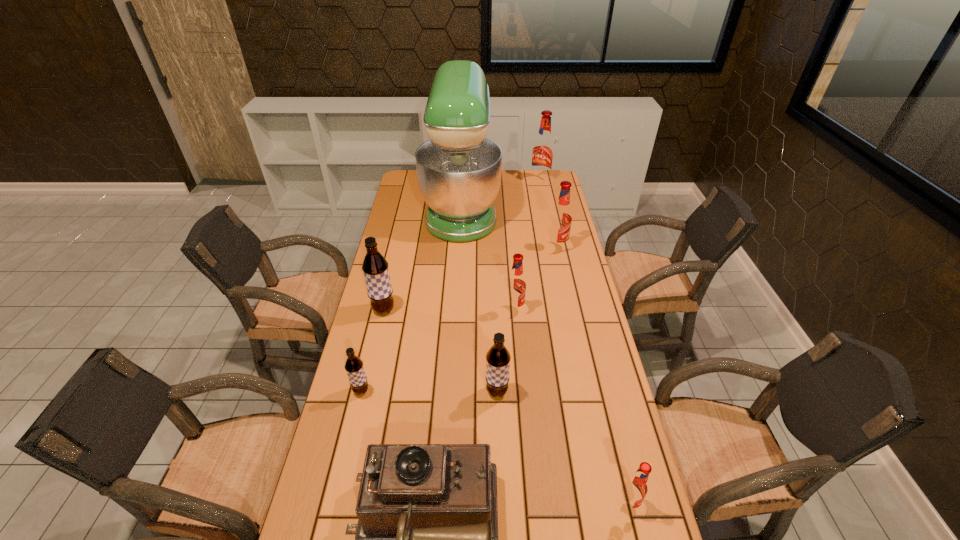
Where is `red root beer that is the closest to the smallest brown root beer`? red root beer that is the closest to the smallest brown root beer is located at coordinates (516, 284).

Where is `red root beer that is the third closest to the second smallest red root beer`? The image size is (960, 540). red root beer that is the third closest to the second smallest red root beer is located at coordinates (543, 149).

Point out which brown root beer is positioned as the nearest to the smallest brown root beer. Please provide its 2D coordinates. Your answer should be formatted as a tuple, i.e. [(x, y)], where the tuple contains the x and y coordinates of a point satisfying the conditions above.

[(375, 267)]

Locate which brown root beer ranks third in proximity to the tallest object. Please provide its 2D coordinates. Your answer should be formatted as a tuple, i.e. [(x, y)], where the tuple contains the x and y coordinates of a point satisfying the conditions above.

[(354, 367)]

What are the coordinates of `vacant space that satisfies the following two spatial constraints: 1. on the front side of the second smallest red root beer; 2. on the left side of the nearest red root beer` in the screenshot? It's located at (531, 504).

Find the location of a particular element. Image resolution: width=960 pixels, height=540 pixels. free space that satisfies the following two spatial constraints: 1. on the controls of the green mixer; 2. on the left side of the second farthest red root beer is located at coordinates (460, 248).

Find the location of a particular element. The height and width of the screenshot is (540, 960). free space that satisfies the following two spatial constraints: 1. on the back side of the smallest red root beer; 2. on the controls of the mixer is located at coordinates (556, 207).

What are the coordinates of `free space that satisfies the following two spatial constraints: 1. on the controls of the green mixer; 2. on the back side of the smallest red root beer` in the screenshot? It's located at (444, 504).